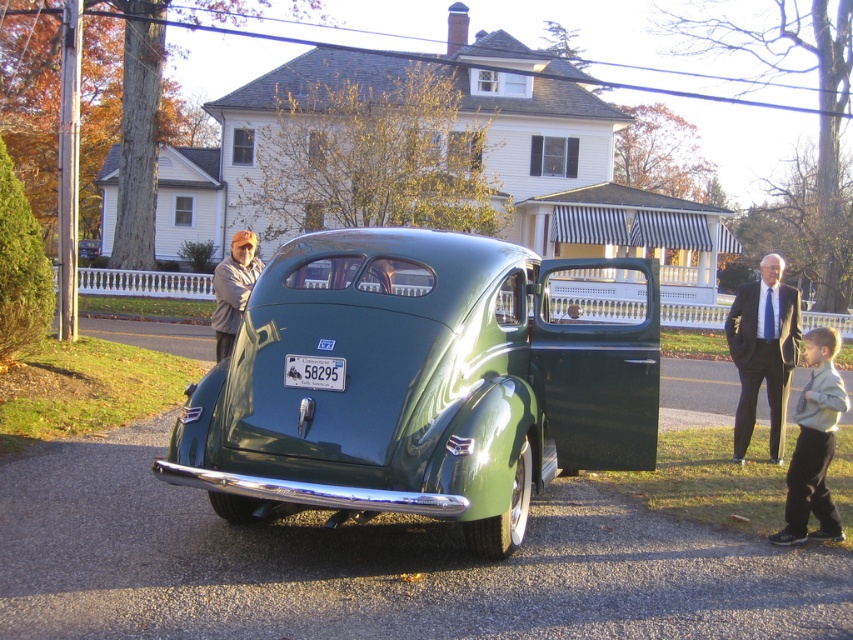
Is point (757, 362) closer to camera compared to point (810, 502)?

No, it is not.

Between point (752, 342) and point (799, 401), which one is positioned behind?

The point (752, 342) is behind.

Locate an element on the screen. dark gray suit at right is located at coordinates click(763, 352).

Where is `dark gray suit at right`? This screenshot has width=853, height=640. dark gray suit at right is located at coordinates (763, 352).

Where is `dark gray suit at right`? Image resolution: width=853 pixels, height=640 pixels. dark gray suit at right is located at coordinates (763, 352).

Looking at this image, how much distance is there between light gray sweater at lower right and white plastic license plate at center?

light gray sweater at lower right is 3.21 meters from white plastic license plate at center.

Does light gray sweater at lower right have a greater height compared to white plastic license plate at center?

Indeed, light gray sweater at lower right has a greater height compared to white plastic license plate at center.

Does point (817, 440) come in front of point (312, 385)?

No, it is behind (312, 385).

I want to click on light gray sweater at lower right, so click(814, 444).